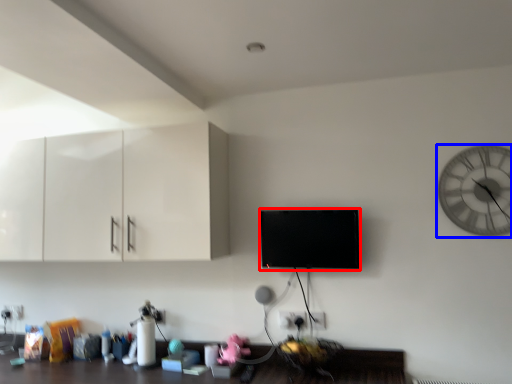
Question: Which point is closer to the camera, flat (highlighted by a red box) or wall clock (highlighted by a blue box)?

Choices:
 (A) flat
 (B) wall clock

Answer: (B)